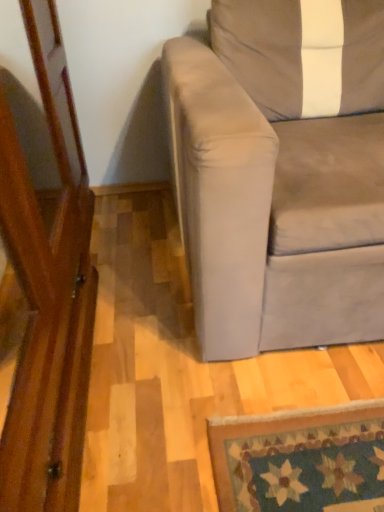
Locate an element on the screen. suede gray couch at right is located at coordinates (281, 173).

This screenshot has width=384, height=512. Describe the element at coordinates (281, 173) in the screenshot. I see `suede gray couch at right` at that location.

This screenshot has height=512, width=384. I want to click on suede gray couch at right, so click(x=281, y=173).